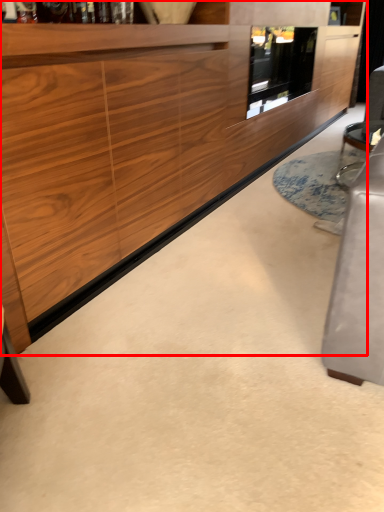
Question: Observing the image, what is the correct spatial positioning of cabinetry (annotated by the red box) in reference to glass door?

Choices:
 (A) right
 (B) left

Answer: (B)